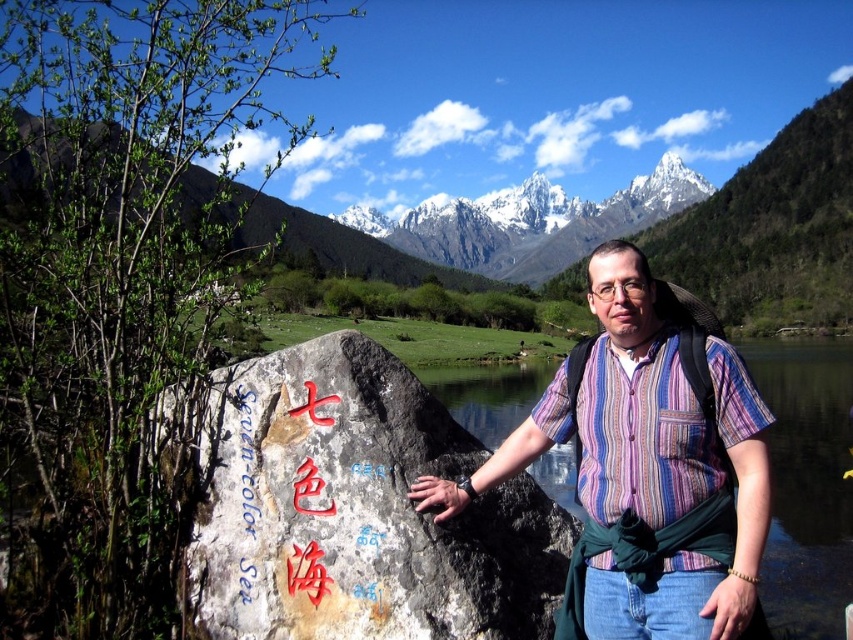
Question: Which point is farther from the camera taking this photo?

Choices:
 (A) (383, 260)
 (B) (589, 561)
 (C) (670, 502)
 (D) (361, 637)

Answer: (A)

Question: From the image, what is the correct spatial relationship of rusty stone boulder at center in relation to striped fabric shirt at center?

Choices:
 (A) above
 (B) below

Answer: (B)

Question: Does snowy granite mountain at upper center appear under striped cotton shirt at center?

Choices:
 (A) no
 (B) yes

Answer: (A)

Question: Is rusty stone boulder at center smaller than white snow-covered mountain at upper center?

Choices:
 (A) yes
 (B) no

Answer: (A)

Question: Which point is farther to the camera?

Choices:
 (A) (239, 419)
 (B) (717, 339)
 (C) (672, 365)

Answer: (B)

Question: Which object appears closest to the camera in this image?

Choices:
 (A) rusty stone boulder at center
 (B) white snow-covered mountain at upper center
 (C) snowy granite mountain at upper center
 (D) striped fabric shirt at center

Answer: (A)